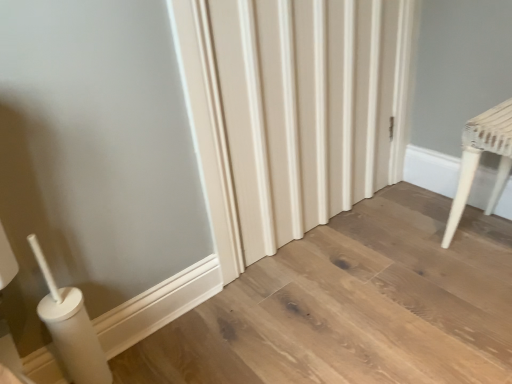
Identify the location of vacant area to the left of white woven stool at right. The width and height of the screenshot is (512, 384). (426, 251).